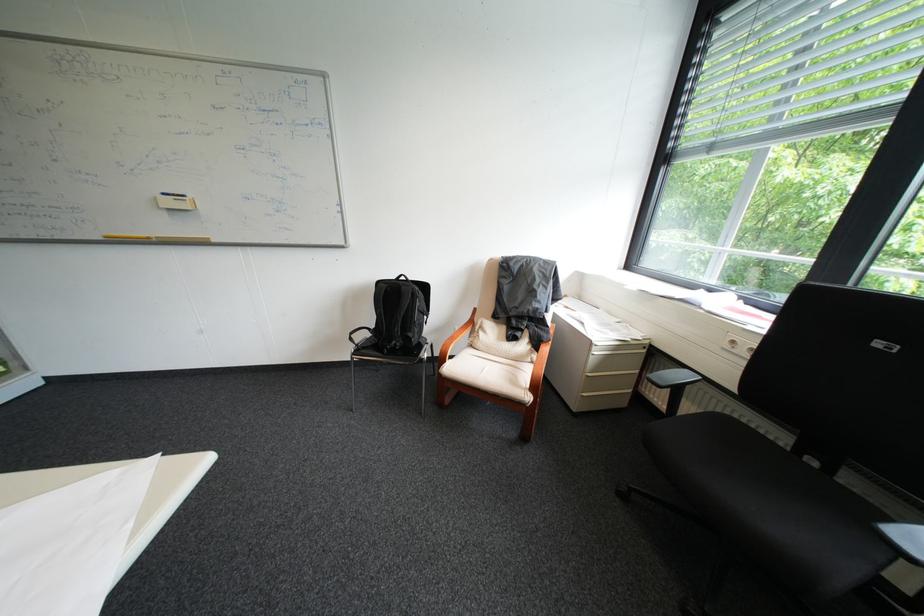
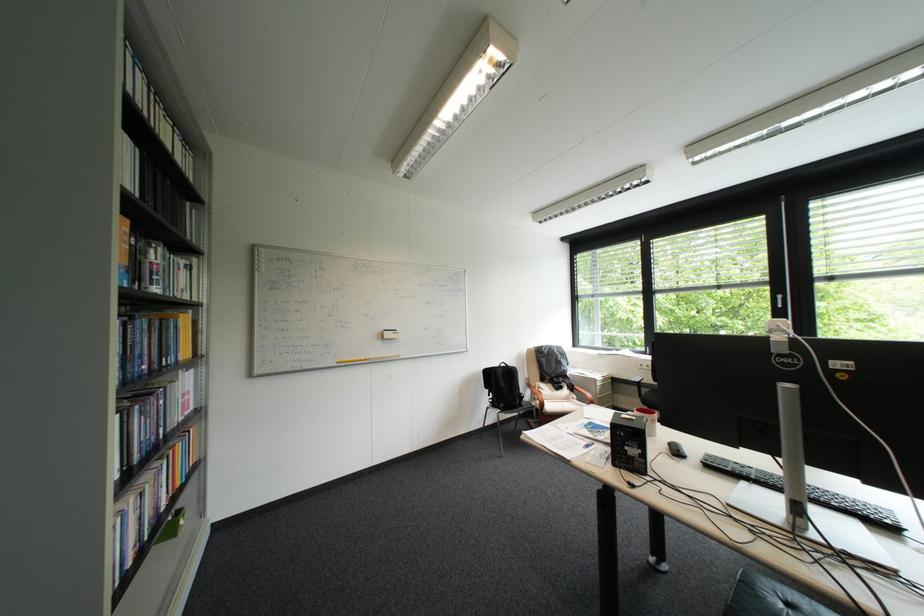
Locate, in the second image, the point that corresponds to point 603,342 in the first image.

(608, 379)